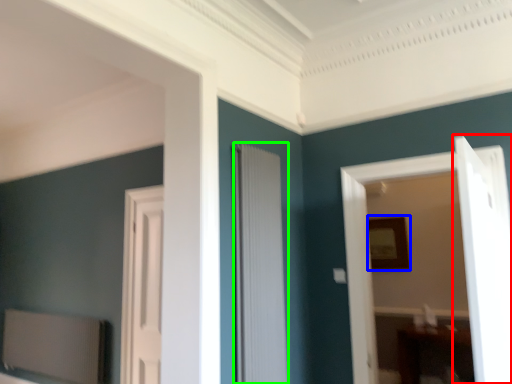
Question: Based on their relative distances, which object is farther from door (highlighted by a red box)? Choose from picture frame (highlighted by a blue box) and door (highlighted by a green box).

Choices:
 (A) picture frame
 (B) door

Answer: (A)